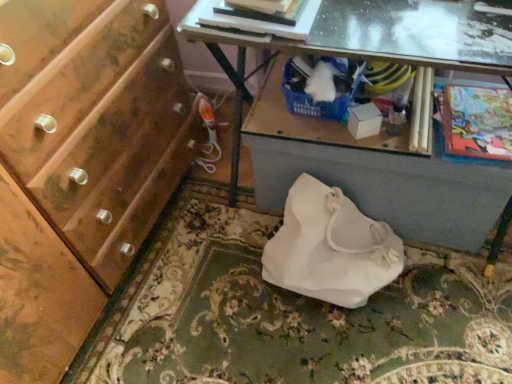
Identify the location of free spot above white fabric bag at lower center (from a real-world perspective). The image size is (512, 384). (406, 129).